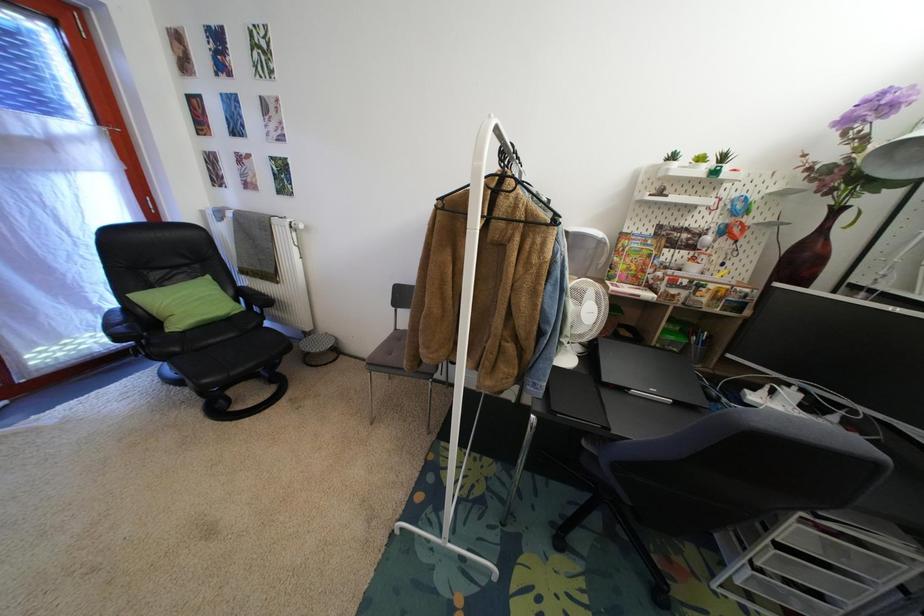
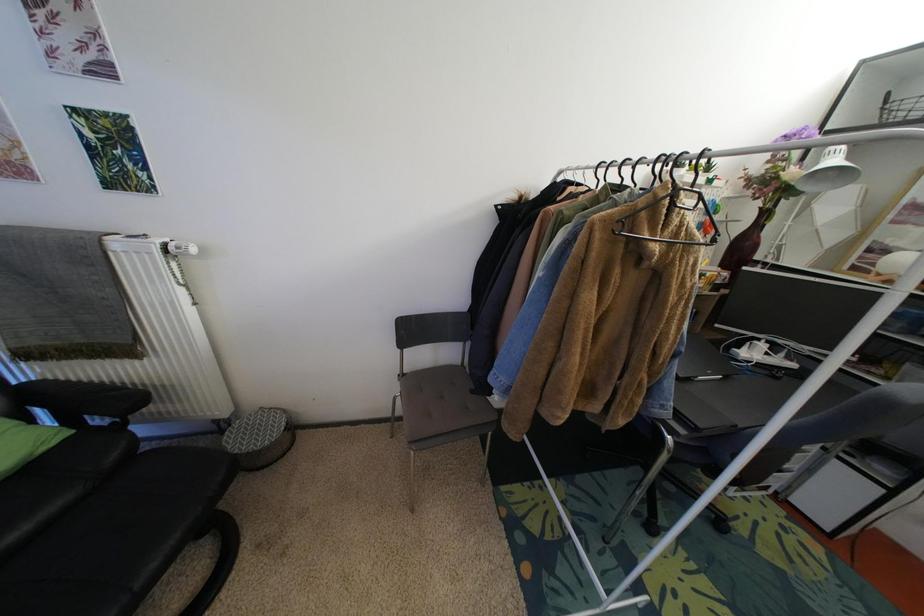
Question: The camera is either moving clockwise (left) or counter-clockwise (right) around the object. The first image is from the beginning of the video and the second image is from the end. Is the camera moving left or right when shooting the video?

Choices:
 (A) Left
 (B) Right

Answer: (A)